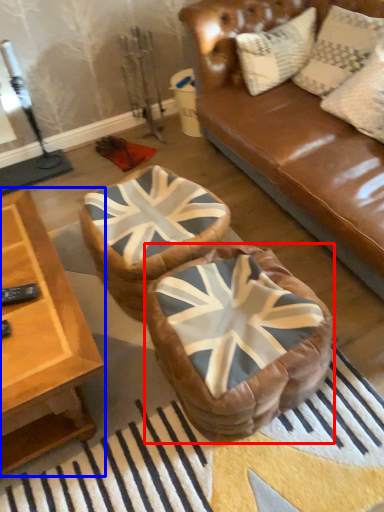
Question: Which object is closer to the camera taking this photo, bean bag chair (highlighted by a red box) or table (highlighted by a blue box)?

Choices:
 (A) bean bag chair
 (B) table

Answer: (B)